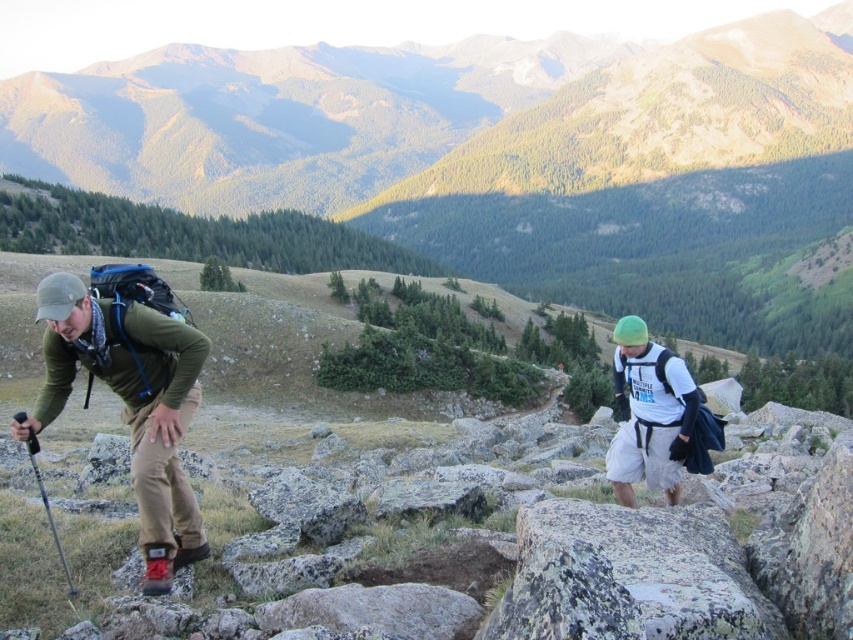
Question: Which of the following is the farthest from the observer?

Choices:
 (A) (635, 381)
 (B) (328, 160)
 (C) (202, 556)

Answer: (B)

Question: Is green grassy mountain at upper center below white matte t-shirt at center-right?

Choices:
 (A) yes
 (B) no

Answer: (B)

Question: Is matte green jacket at left bigger than white matte t-shirt at center-right?

Choices:
 (A) no
 (B) yes

Answer: (B)

Question: Which point is farther from the camera taking this photo?

Choices:
 (A) (680, 417)
 (B) (180, 541)

Answer: (A)

Question: Observing the image, what is the correct spatial positioning of green grassy mountain at upper center in reference to matte green jacket at left?

Choices:
 (A) right
 (B) left

Answer: (B)

Question: Among these objects, which one is nearest to the camera?

Choices:
 (A) matte green jacket at left
 (B) green grassy mountain at upper center

Answer: (A)